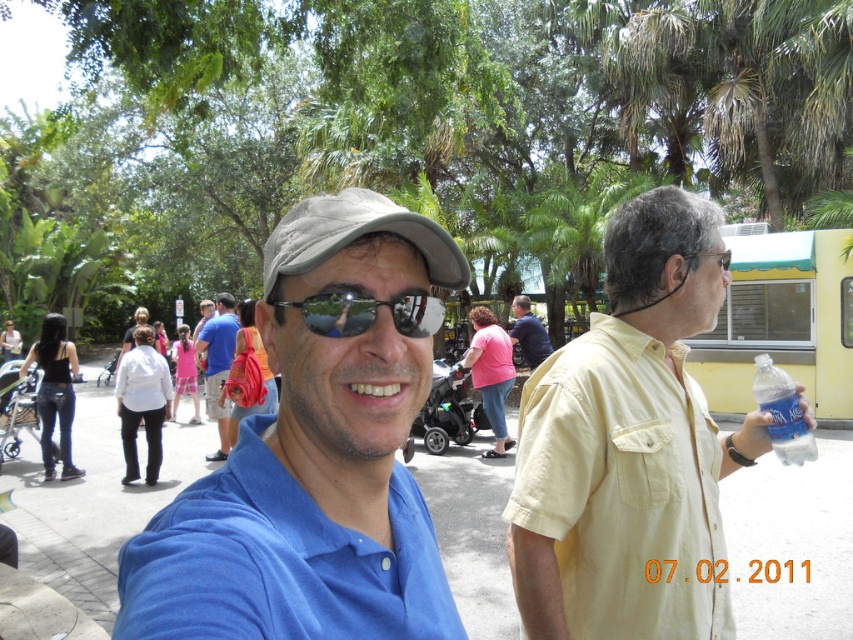
You are a photographer trying to capture both the blue matte shirt at center and the matte blue shirt at center in a single frame. Which one should you focus on first to ensure it appears clearer in the photo?

The blue matte shirt at center is larger in size than the matte blue shirt at center, so focusing on the blue matte shirt at center first will ensure it appears clearer in the photo.

You are a photographer trying to capture a candid shot of the blue matte shirt at center and the sunglasses at center in the same frame. Given the distance between them, will you need to adjust your camera lens to a wider angle to ensure both subjects are fully visible?

The distance between the blue matte shirt at center and sunglasses at center is 9.36 centimeters, so you will need to adjust your camera lens to a wider angle to ensure both subjects are fully visible in the frame.